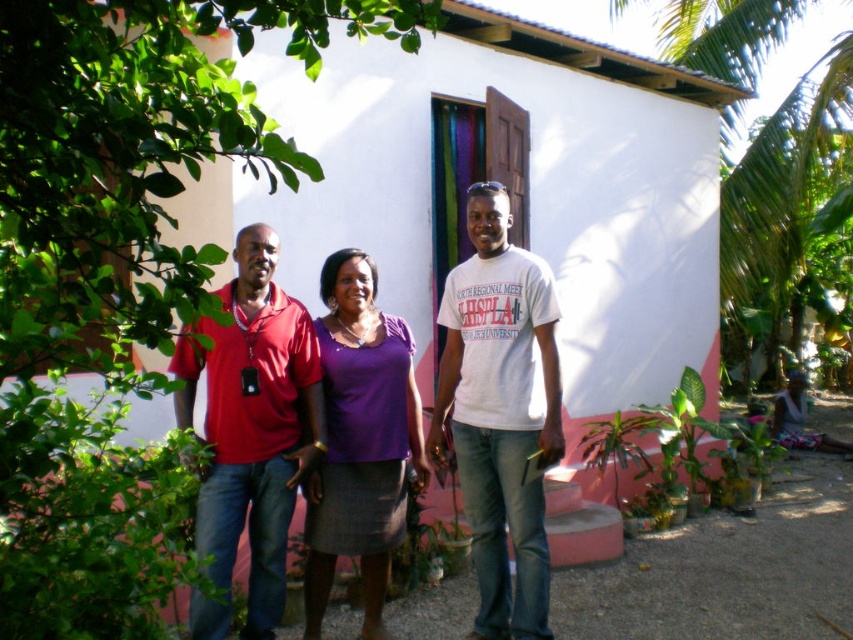
You are a photographer standing 10 feet away from the two people wearing the matte red shirt at center and the purple matte shirt at center. You want to take a photo where both shirts are in focus. Given that your camera has a depth of field that can cover 5 inches, will both shirts be in focus?

The matte red shirt at center and purple matte shirt at center are 6.03 inches apart from each other. Since the camera has a depth of field of 5 inches, which is less than the distance between them, both shirts may not be fully in focus. The photographer might need to adjust the camera settings or position to ensure both are sharp.

You are trying to decide which person to approach for directions. The matte red shirt at left and the purple matte shirt at center are both facing you. Which one is shorter?

The matte red shirt at left is shorter than the purple matte shirt at center.